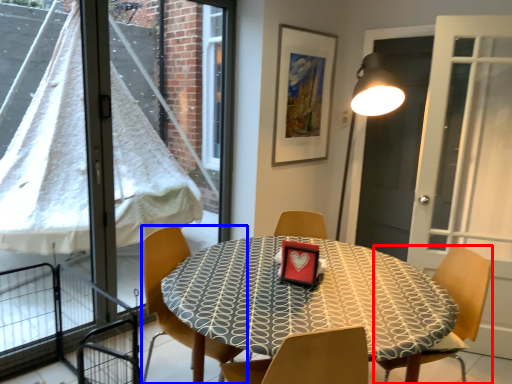
Question: Which object is further to the camera taking this photo, chair (highlighted by a red box) or chair (highlighted by a blue box)?

Choices:
 (A) chair
 (B) chair

Answer: (B)